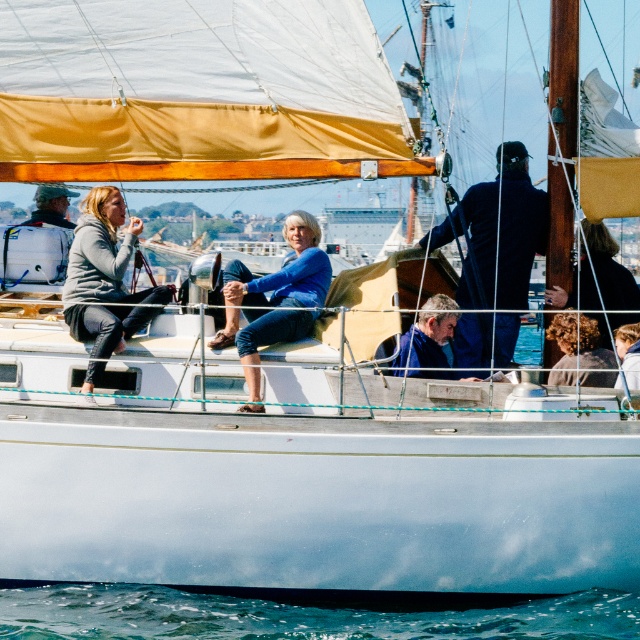
Does point (275, 284) lie in front of point (627, 378)?

No, (275, 284) is further to viewer.

Between blue denim jeans at center and smooth brown hair at center, which one is positioned lower?

Positioned lower is smooth brown hair at center.

Locate an element on the screen. This screenshot has height=640, width=640. blue denim jeans at center is located at coordinates (275, 300).

Who is lower down, gray fleece jacket at left or dark brown leather jacket at lower right?

dark brown leather jacket at lower right is below.

Is gray fleece jacket at left to the right of dark brown leather jacket at lower right from the viewer's perspective?

In fact, gray fleece jacket at left is to the left of dark brown leather jacket at lower right.

Between point (81, 272) and point (605, 333), which one is positioned in front?

Point (81, 272) is more forward.

Identify the location of gray fleece jacket at left. The width and height of the screenshot is (640, 640). (104, 253).

Does blue water at lower left have a lesser height compared to brown wooden mast at upper center?

Correct, blue water at lower left is not as tall as brown wooden mast at upper center.

Who is more distant from viewer, (312, 611) or (552, 80)?

Positioned behind is point (552, 80).

Locate an element on the screen. Image resolution: width=640 pixels, height=640 pixels. blue water at lower left is located at coordinates (305, 614).